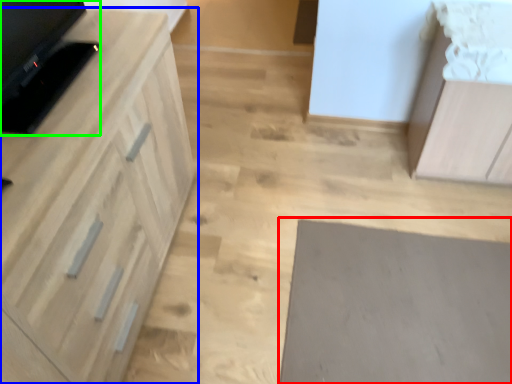
Question: Which object is positioned closest to mat (highlighted by a red box)? Select from cabinetry (highlighted by a blue box) and appliance (highlighted by a green box).

Choices:
 (A) cabinetry
 (B) appliance

Answer: (A)